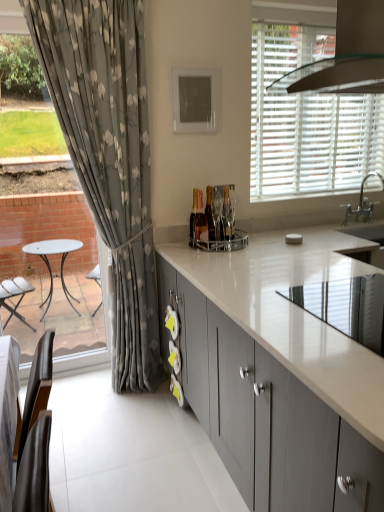
At what (x,y) coordinates should I click in order to perform the action: click on free spot below white glossy sink at upper right (from a real-world perspective). Please return your answer as a coordinate pair (x, y). The width and height of the screenshot is (384, 512). Looking at the image, I should click on (366, 221).